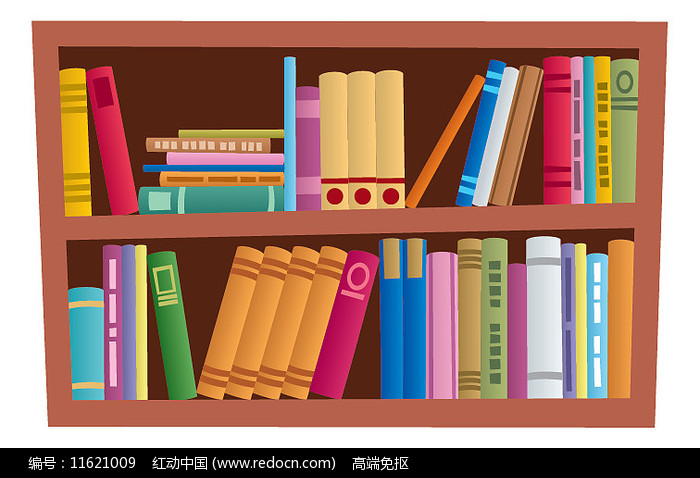
What are the coordinates of `orange/brown books` in the screenshot? It's located at (231, 304), (266, 304), (292, 304), (318, 304), (246, 178), (519, 137), (453, 127), (472, 302).